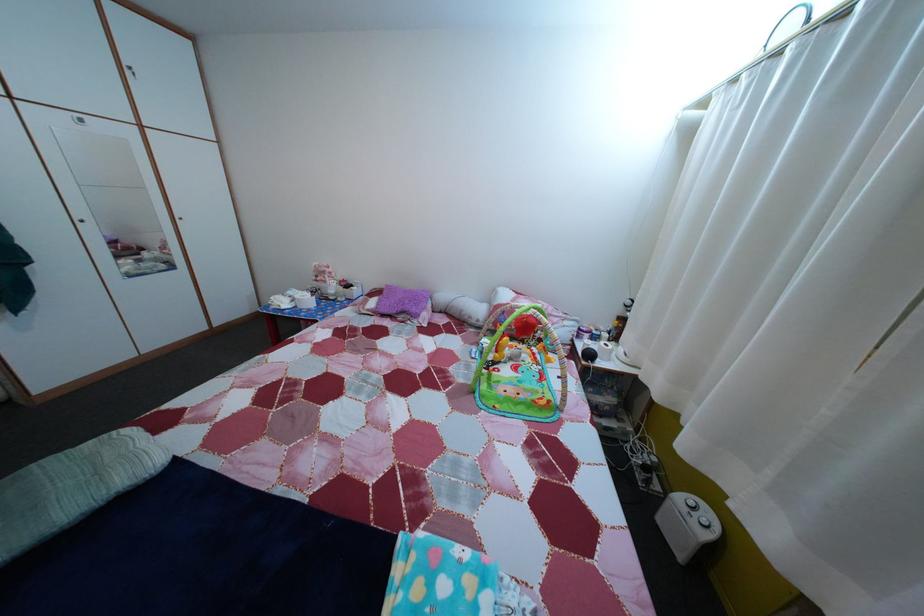
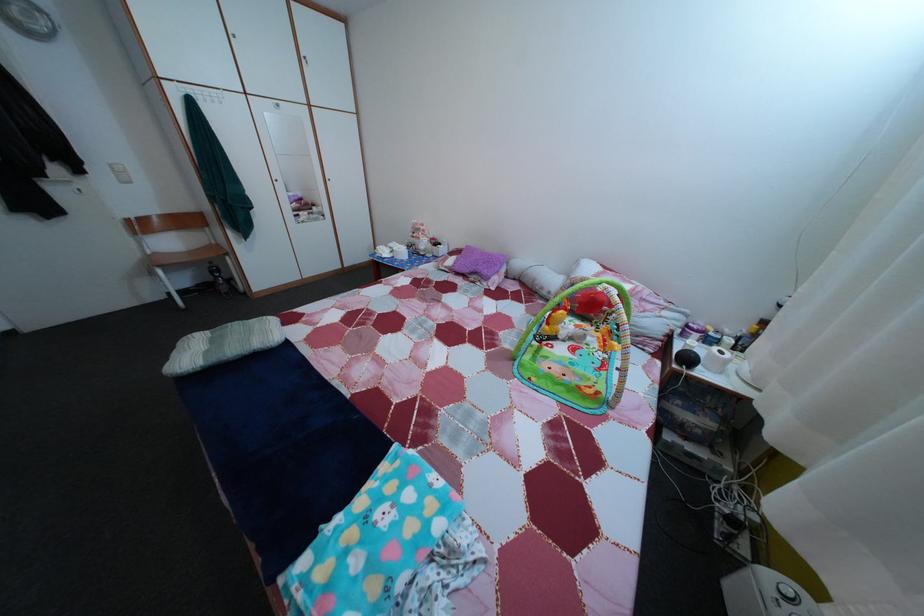
In the second image, find the point that corresponds to (x=604, y=345) in the first image.

(718, 349)